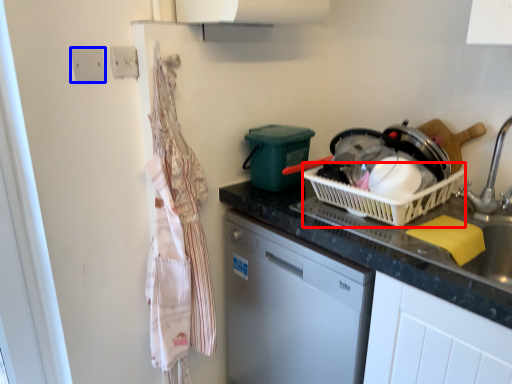
Question: Among these objects, which one is nearest to the camera, basket (highlighted by a red box) or electric outlet (highlighted by a blue box)?

Choices:
 (A) basket
 (B) electric outlet

Answer: (A)